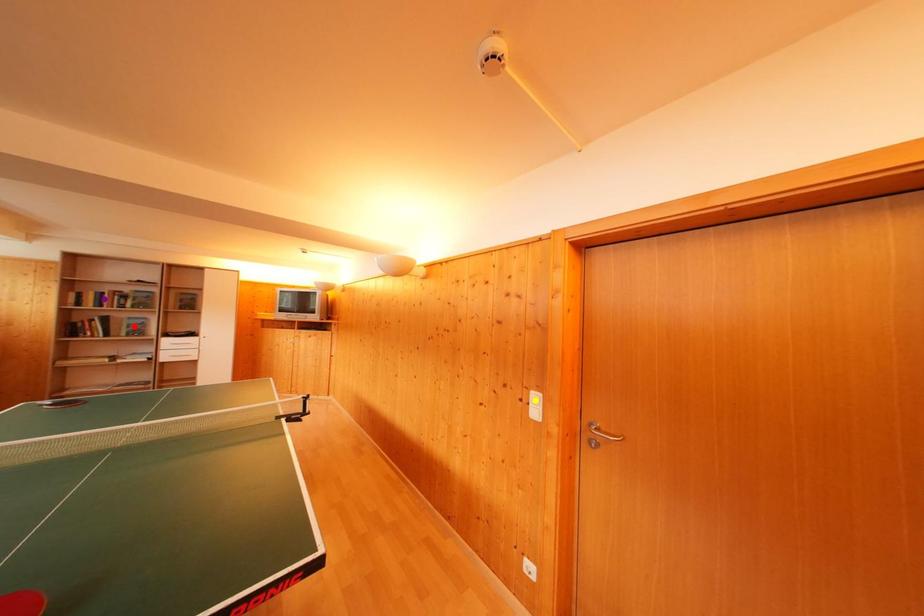
Based on the photo, order these from nearest to farthest:
1. yellow point
2. purple point
3. red point

yellow point → purple point → red point